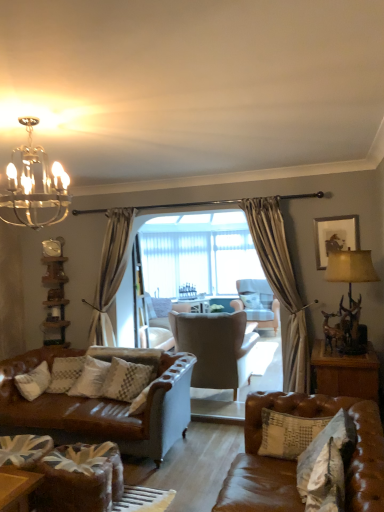
Question: From a real-world perspective, is clear glass screen door at center on top of white textured pillow at center, marked as the first pillow in a right-to-left arrangement?

Choices:
 (A) no
 (B) yes

Answer: (B)

Question: From the image's perspective, is clear glass screen door at center on top of white textured pillow at center, which is the first pillow in back-to-front order?

Choices:
 (A) no
 (B) yes

Answer: (B)

Question: Can you confirm if clear glass screen door at center is shorter than white textured pillow at center, the fourth pillow in the front-to-back sequence?

Choices:
 (A) yes
 (B) no

Answer: (B)

Question: Is the depth of clear glass screen door at center less than that of white textured pillow at center, marked as the first pillow in a right-to-left arrangement?

Choices:
 (A) no
 (B) yes

Answer: (B)

Question: Is clear glass screen door at center bigger than white textured pillow at center, which is the first pillow in back-to-front order?

Choices:
 (A) no
 (B) yes

Answer: (B)

Question: Considering the relative sizes of clear glass screen door at center and white textured pillow at center, which is the fourth pillow in left-to-right order, in the image provided, is clear glass screen door at center taller than white textured pillow at center, which is the fourth pillow in left-to-right order,?

Choices:
 (A) yes
 (B) no

Answer: (A)

Question: From a real-world perspective, is wooden framed picture at upper right located beneath white textured pillow at center, which is the 1th pillow in left-to-right order?

Choices:
 (A) yes
 (B) no

Answer: (B)

Question: Considering the relative sizes of wooden framed picture at upper right and white textured pillow at center, which is the 1th pillow in left-to-right order, in the image provided, is wooden framed picture at upper right smaller than white textured pillow at center, which is the 1th pillow in left-to-right order,?

Choices:
 (A) yes
 (B) no

Answer: (A)

Question: Does wooden framed picture at upper right have a greater width compared to white textured pillow at center, acting as the fourth pillow starting from the right?

Choices:
 (A) no
 (B) yes

Answer: (A)

Question: Is wooden framed picture at upper right aimed at white textured pillow at center, arranged as the 3th pillow when viewed from the front?

Choices:
 (A) yes
 (B) no

Answer: (B)

Question: Does wooden framed picture at upper right have a lesser height compared to white textured pillow at center, arranged as the 3th pillow when viewed from the front?

Choices:
 (A) no
 (B) yes

Answer: (B)

Question: From a real-world perspective, is wooden framed picture at upper right positioned over white textured pillow at center, the second pillow when ordered from back to front, based on gravity?

Choices:
 (A) yes
 (B) no

Answer: (A)

Question: Does suede wingback chair at center, placed as the first chair when sorted from left to right, appear on the left side of brown leather table at lower right?

Choices:
 (A) no
 (B) yes

Answer: (B)